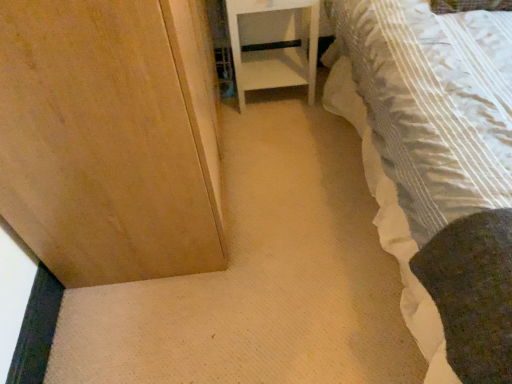
Question: Is white glossy nightstand at center inside or outside of white striped fabric bed at lower right?

Choices:
 (A) inside
 (B) outside

Answer: (B)

Question: Looking at the image, does white glossy nightstand at center seem bigger or smaller compared to white striped fabric bed at lower right?

Choices:
 (A) big
 (B) small

Answer: (B)

Question: From the image's perspective, is white glossy nightstand at center positioned above or below white striped fabric bed at lower right?

Choices:
 (A) above
 (B) below

Answer: (A)

Question: Which is correct: white striped fabric bed at lower right is inside white glossy nightstand at center, or outside of it?

Choices:
 (A) inside
 (B) outside

Answer: (B)

Question: Based on their positions, is white striped fabric bed at lower right located to the left or right of white glossy nightstand at center?

Choices:
 (A) left
 (B) right

Answer: (B)

Question: Is white striped fabric bed at lower right bigger or smaller than white glossy nightstand at center?

Choices:
 (A) big
 (B) small

Answer: (A)

Question: In terms of width, does white striped fabric bed at lower right look wider or thinner when compared to white glossy nightstand at center?

Choices:
 (A) wide
 (B) thin

Answer: (A)